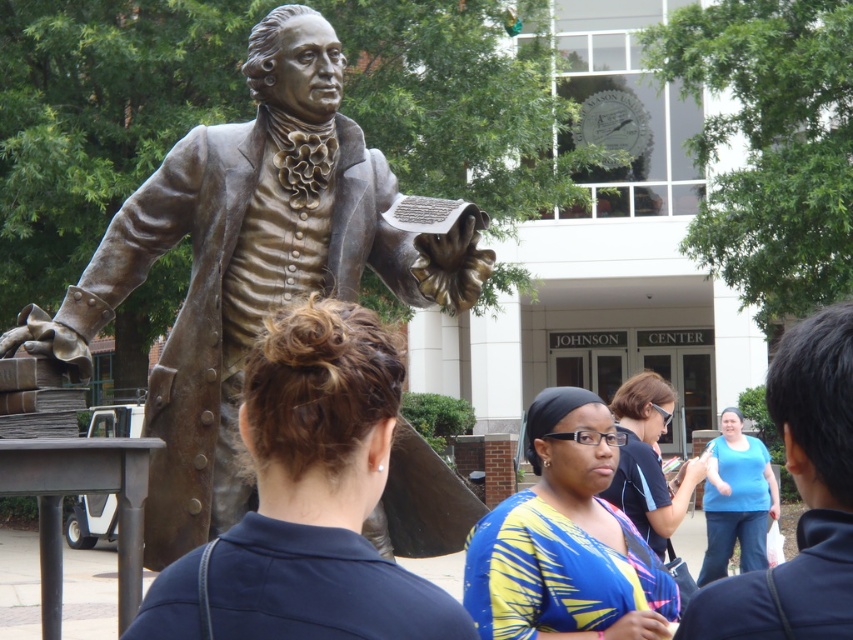
Is the position of dark brown hair at center less distant than that of blue printed blouse at center?

That is True.

Does dark brown hair at center come behind blue printed blouse at center?

No, dark brown hair at center is in front of blue printed blouse at center.

Locate an element on the screen. dark brown hair at center is located at coordinates (306, 500).

This screenshot has height=640, width=853. Identify the location of dark brown hair at center. (306, 500).

Is point (569, 566) closer to camera compared to point (738, 428)?

Yes, point (569, 566) is closer to viewer.

Which is behind, point (589, 428) or point (722, 525)?

Positioned behind is point (722, 525).

Between point (581, 532) and point (772, 504), which one is positioned in front?

Point (581, 532) is in front.

This screenshot has height=640, width=853. In order to click on blue printed blouse at center in this screenshot , I will do `click(566, 540)`.

Between blue printed blouse at center and blue shirt at right, which one is positioned lower?

Positioned lower is blue printed blouse at center.

What do you see at coordinates (566, 540) in the screenshot?
I see `blue printed blouse at center` at bounding box center [566, 540].

Does point (647, 592) come in front of point (734, 611)?

No, (647, 592) is behind (734, 611).

Find the location of `blue printed blouse at center`. blue printed blouse at center is located at coordinates (566, 540).